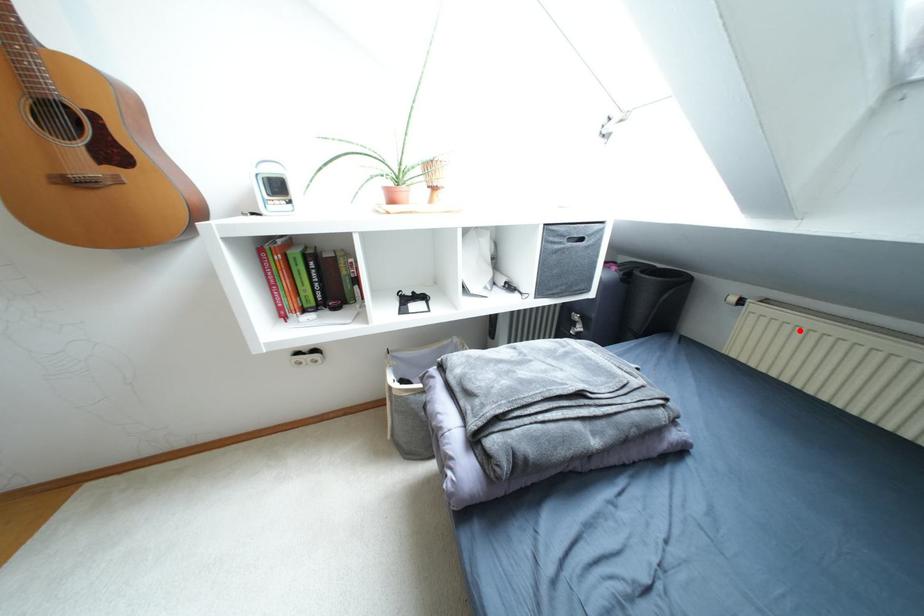
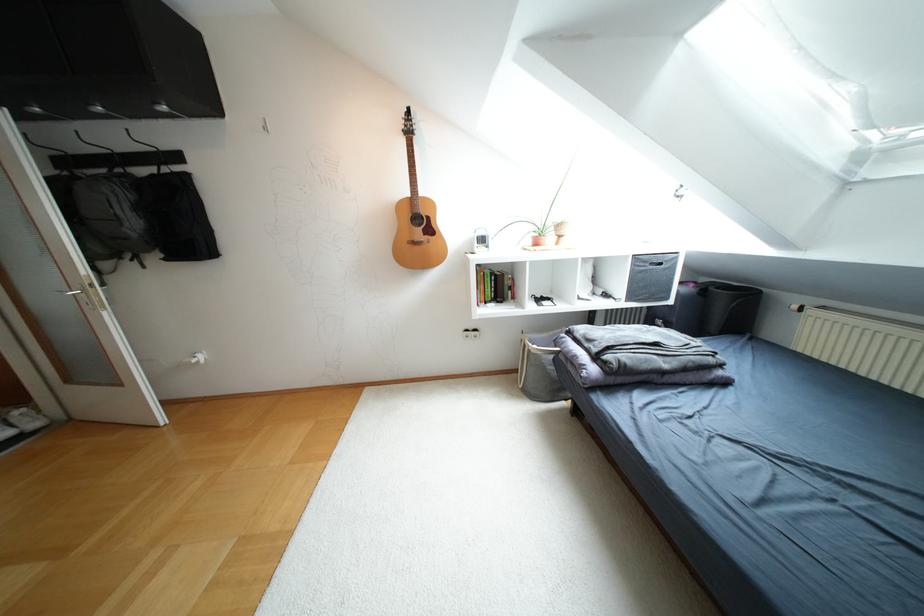
Question: I am providing you with two images of the same scene from different viewpoints. Image1 has a red point marked. In image2, the corresponding 3D location appears at what relative position? Reply with the corresponding letter.

Choices:
 (A) Closer
 (B) Farther

Answer: (B)